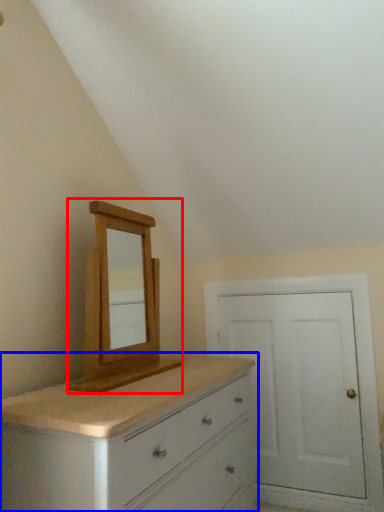
Question: Which of the following is the farthest to the observer, medicine cabinet (highlighted by a red box) or chest of drawers (highlighted by a blue box)?

Choices:
 (A) medicine cabinet
 (B) chest of drawers

Answer: (A)